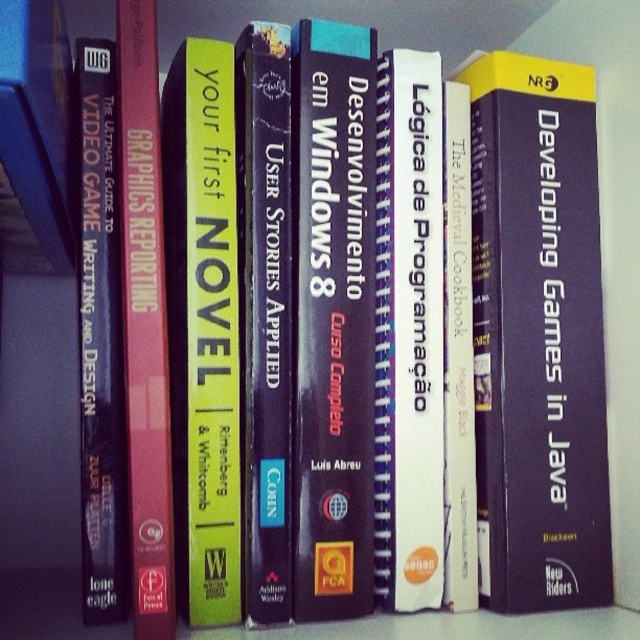
Who is more forward, [273,321] or [156,394]?

Point [156,394] is more forward.

Between point (273, 248) and point (160, 515), which one is positioned behind?

The point (273, 248) is more distant.

Where is `dark blue hardcover book at center`? The height and width of the screenshot is (640, 640). dark blue hardcover book at center is located at coordinates (264, 316).

Is white matte book at center smaller than dark blue hardcover book at center?

Indeed, white matte book at center has a smaller size compared to dark blue hardcover book at center.

Which is in front, point (387, 269) or point (257, 193)?

Point (257, 193)

Identify the location of white matte book at center. The width and height of the screenshot is (640, 640). (408, 332).

Between purple hardcover book at center and yellow matte book at center, which one appears on the left side from the viewer's perspective?

Positioned to the left is yellow matte book at center.

Describe the element at coordinates (538, 337) in the screenshot. Image resolution: width=640 pixels, height=640 pixels. I see `purple hardcover book at center` at that location.

I want to click on purple hardcover book at center, so click(x=538, y=337).